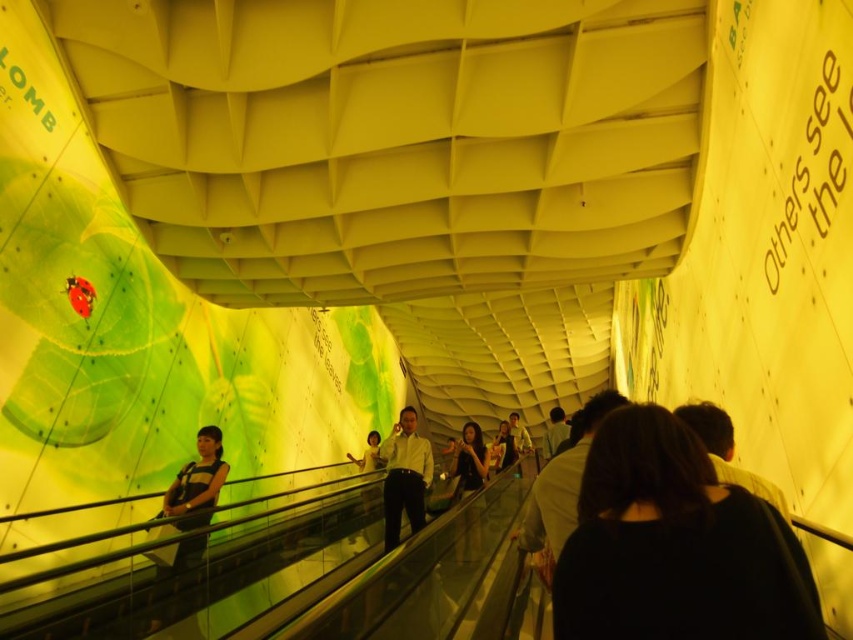
You are standing at the bottom of the escalator and notice two people in front of you. One has black hair at center and the other has a light brown shirt at center. Which person is closer to you?

The black hair at center is closer to the viewer than the light brown shirt at center, so the person with black hair at center is closer to you.

You are standing in the escalator area and see the black hair at center and the light brown shirt at center. Which one is positioned to the right side?

The black hair at center is positioned to the right of the light brown shirt at center.